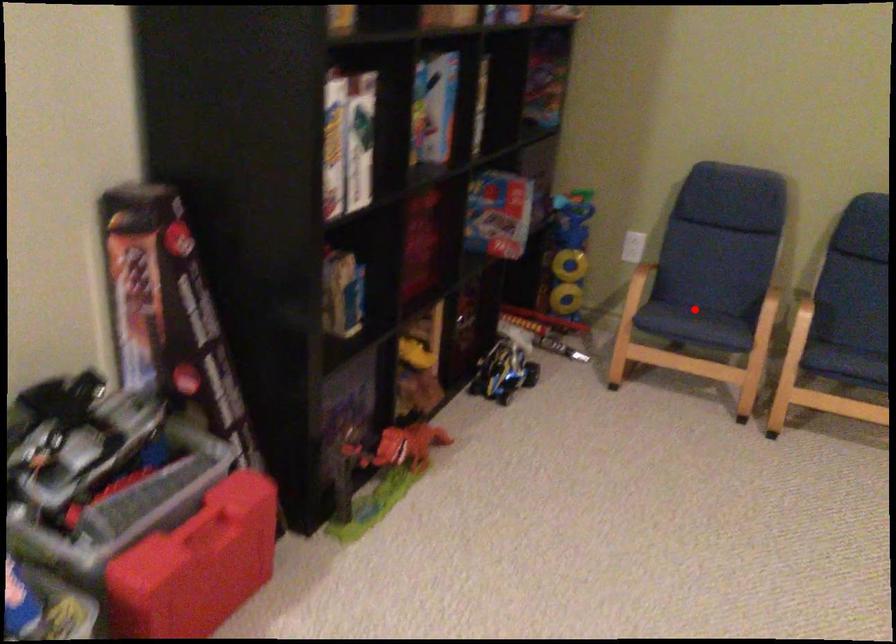
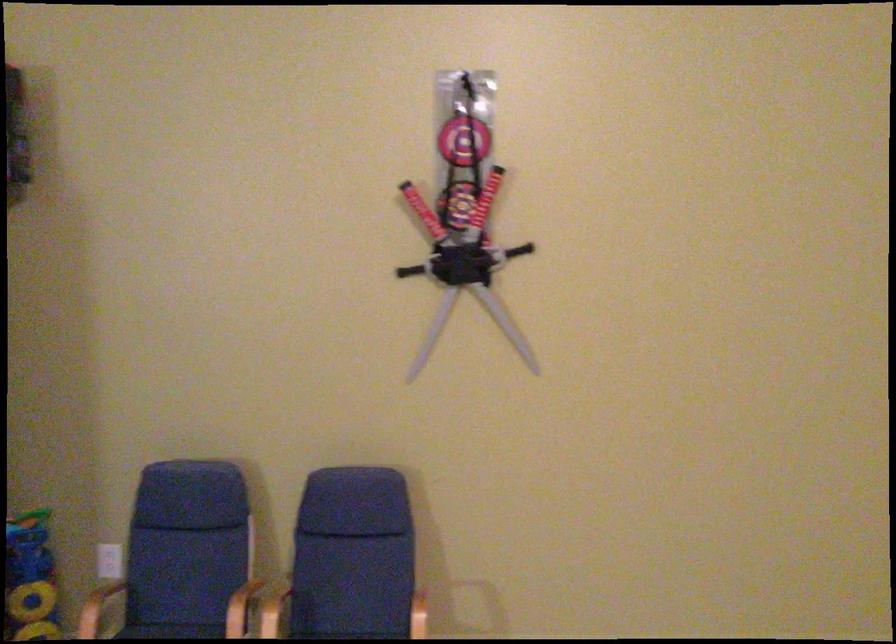
The point at the highlighted location is marked in the first image. Where is the corresponding point in the second image?

(169, 630)